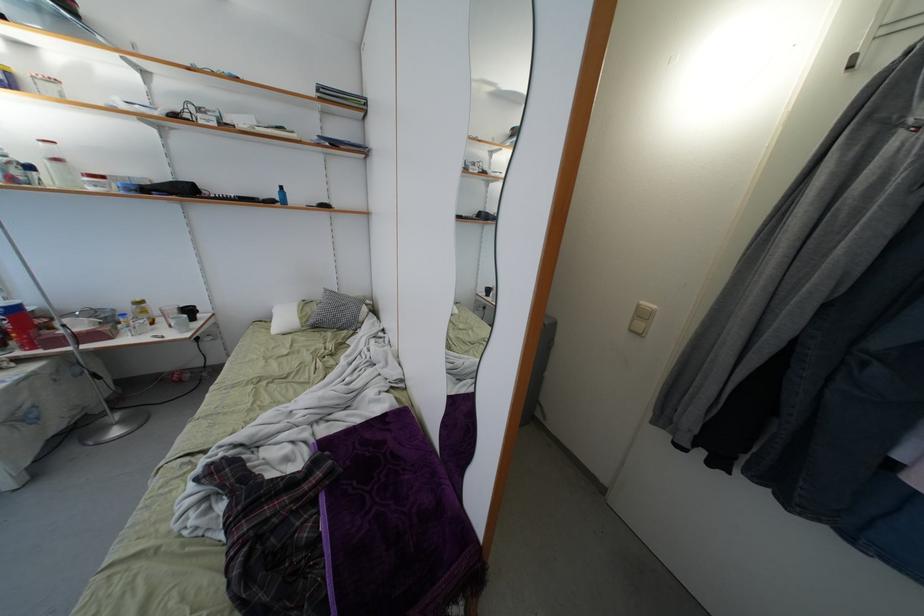
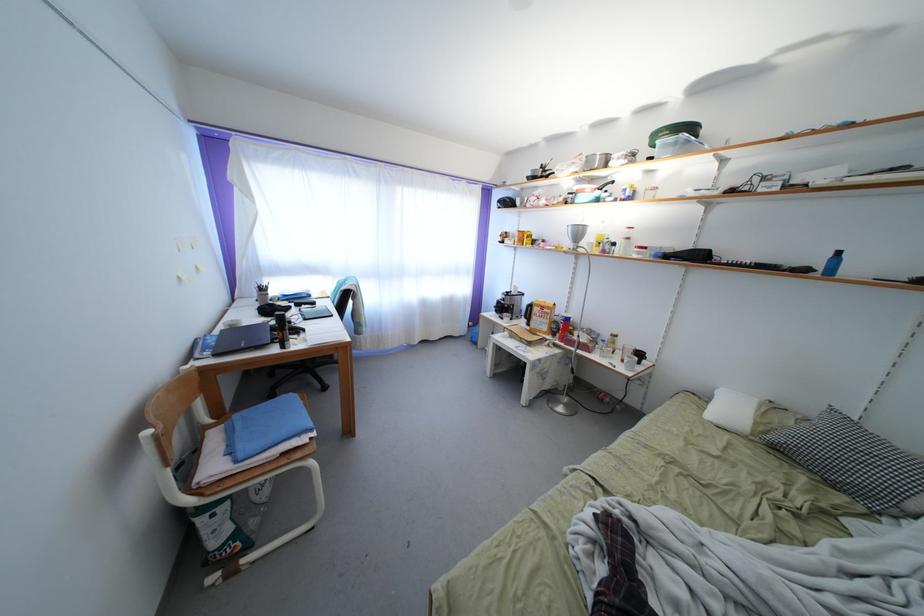
Where in the second image is the point corresponding to (x=314, y=328) from the first image?

(779, 444)